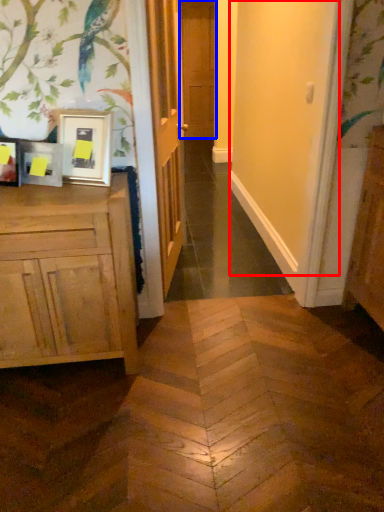
Question: Which of the following is the closest to the observer, screen door (highlighted by a red box) or door (highlighted by a blue box)?

Choices:
 (A) screen door
 (B) door

Answer: (A)